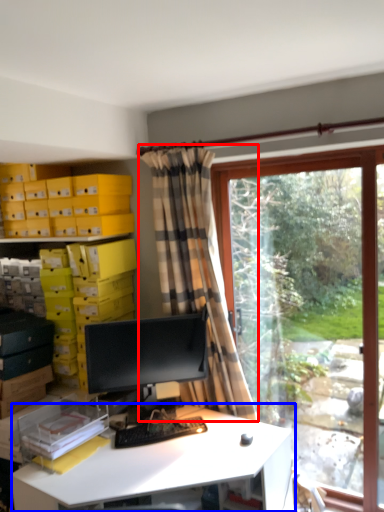
Question: Which object is further to the camera taking this photo, curtain (highlighted by a red box) or desk (highlighted by a blue box)?

Choices:
 (A) curtain
 (B) desk

Answer: (A)